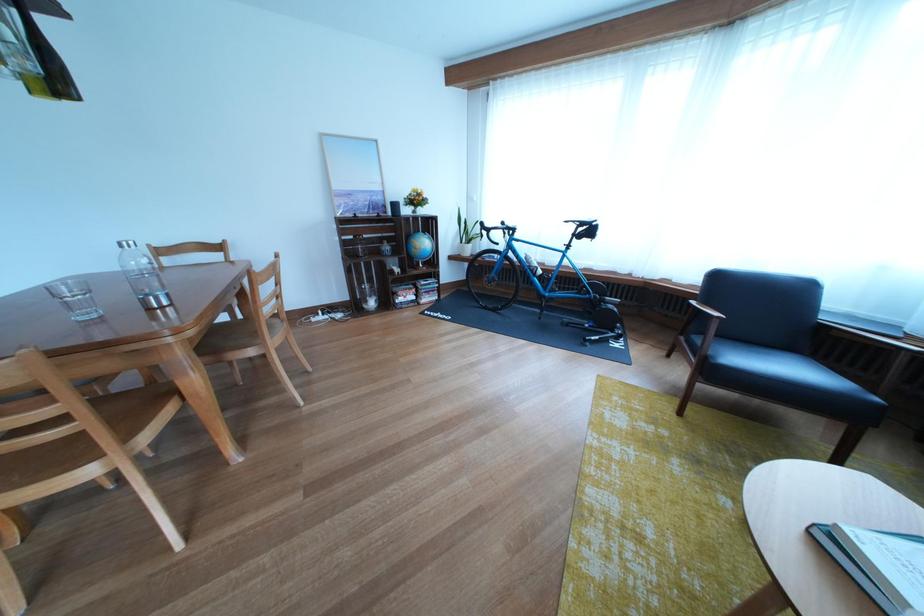
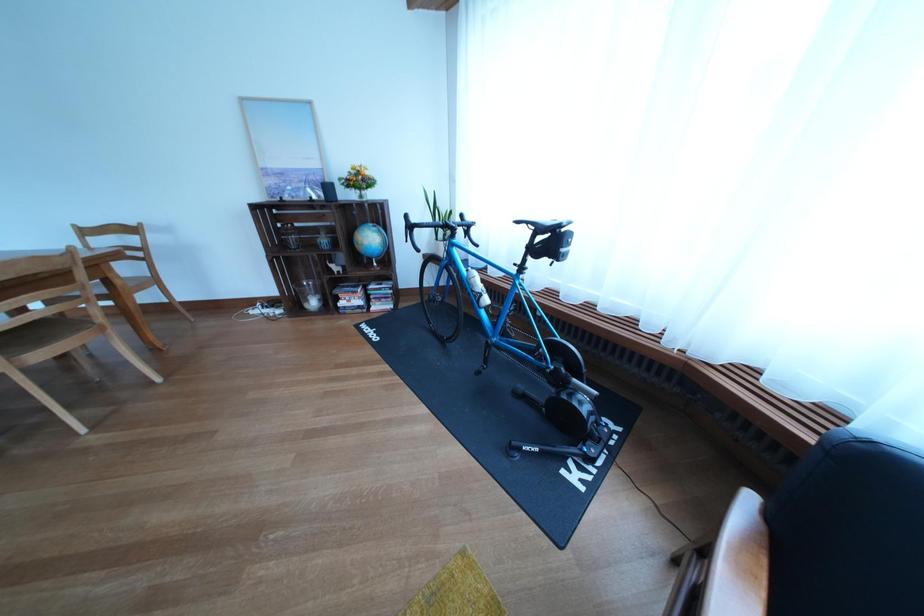
The images are taken continuously from a first-person perspective. In which direction are you moving?

The cameraman walked toward right, forward.